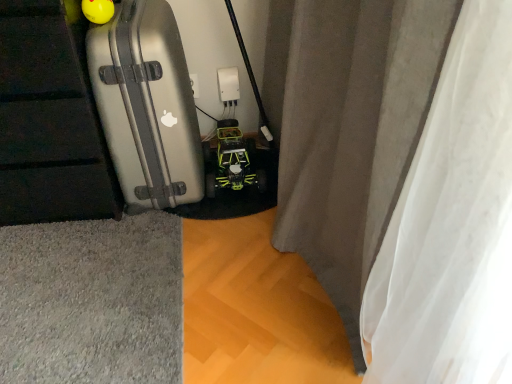
Measure the distance between yellow-green plastic toy car at center and camera.

The depth of yellow-green plastic toy car at center is 5.39 feet.

What is the approximate width of gray fabric curtain at center?

The width of gray fabric curtain at center is 9.13 inches.

Find the location of a particular element. The width and height of the screenshot is (512, 384). yellow-green plastic toy car at center is located at coordinates (232, 161).

Are silver metallic suitcase at left and yellow-green plastic toy car at center far apart?

silver metallic suitcase at left is actually quite close to yellow-green plastic toy car at center.

Does point (112, 41) come in front of point (229, 175)?

Yes, point (112, 41) is in front of point (229, 175).

Is yellow-green plastic toy car at center completely or partially inside silver metallic suitcase at left?

Definitely not — yellow-green plastic toy car at center is not inside silver metallic suitcase at left.

In terms of height, does silver metallic suitcase at left look taller or shorter compared to yellow-green plastic toy car at center?

Clearly, silver metallic suitcase at left is taller compared to yellow-green plastic toy car at center.

From their relative heights in the image, would you say yellow-green plastic toy car at center is taller or shorter than silver metallic suitcase at left?

Clearly, yellow-green plastic toy car at center is shorter compared to silver metallic suitcase at left.

Is yellow-green plastic toy car at center not near silver metallic suitcase at left?

No.

Considering the relative positions of yellow-green plastic toy car at center and silver metallic suitcase at left in the image provided, is yellow-green plastic toy car at center to the left of silver metallic suitcase at left from the viewer's perspective?

Incorrect, yellow-green plastic toy car at center is not on the left side of silver metallic suitcase at left.

From the image's perspective, is yellow-green plastic toy car at center above silver metallic suitcase at left?

No, from the image's perspective, yellow-green plastic toy car at center is not over silver metallic suitcase at left.

Between gray fabric curtain at center and silver metallic suitcase at left, which one has smaller width?

Thinner between the two is gray fabric curtain at center.

From the image's perspective, relative to silver metallic suitcase at left, is gray fabric curtain at center above or below?

Based on their image positions, gray fabric curtain at center is located beneath silver metallic suitcase at left.

Which of these two, gray fabric curtain at center or silver metallic suitcase at left, stands taller?

gray fabric curtain at center is taller.

Is the position of gray fabric curtain at center less distant than that of yellow-green plastic toy car at center?

Yes.

Consider the image. From the image's perspective, is gray fabric curtain at center beneath yellow-green plastic toy car at center?

No, from the image's perspective, gray fabric curtain at center is not beneath yellow-green plastic toy car at center.

Find the location of a particular element. curtain that is on the right side of yellow-green plastic toy car at center is located at coordinates (353, 132).

Can you confirm if silver metallic suitcase at left is thinner than gray fabric curtain at center?

In fact, silver metallic suitcase at left might be wider than gray fabric curtain at center.

At what (x,y) coordinates should I click in order to perform the action: click on suitcase behind the gray fabric curtain at center. Please return your answer as a coordinate pair (x, y). The height and width of the screenshot is (384, 512). Looking at the image, I should click on (147, 105).

Relative to gray fabric curtain at center, is silver metallic suitcase at left in front or behind?

Visually, silver metallic suitcase at left is located behind gray fabric curtain at center.

Which of these two, silver metallic suitcase at left or gray fabric curtain at center, stands taller?

With more height is gray fabric curtain at center.

In the scene shown: Is yellow-green plastic toy car at center far away from gray fabric curtain at center?

No, yellow-green plastic toy car at center is in close proximity to gray fabric curtain at center.

Is yellow-green plastic toy car at center in front of gray fabric curtain at center?

That is False.

Is yellow-green plastic toy car at center facing towards gray fabric curtain at center?

No.

In terms of width, does yellow-green plastic toy car at center look wider or thinner when compared to gray fabric curtain at center?

Clearly, yellow-green plastic toy car at center has more width compared to gray fabric curtain at center.

This screenshot has height=384, width=512. Identify the location of toy car on the right of silver metallic suitcase at left. (232, 161).

Identify the location of toy car below the silver metallic suitcase at left (from the image's perspective). (232, 161).

Based on their spatial positions, is silver metallic suitcase at left or gray fabric curtain at center closer to yellow-green plastic toy car at center?

Based on the image, silver metallic suitcase at left appears to be nearer to yellow-green plastic toy car at center.

Which object lies further to the anchor point silver metallic suitcase at left, gray fabric curtain at center or yellow-green plastic toy car at center?

gray fabric curtain at center is further to silver metallic suitcase at left.

Which object lies further to the anchor point gray fabric curtain at center, yellow-green plastic toy car at center or silver metallic suitcase at left?

Among the two, yellow-green plastic toy car at center is located further to gray fabric curtain at center.

Estimate the real-world distances between objects in this image. Which object is further from yellow-green plastic toy car at center, gray fabric curtain at center or silver metallic suitcase at left?

Based on the image, gray fabric curtain at center appears to be further to yellow-green plastic toy car at center.

Considering their positions, is yellow-green plastic toy car at center positioned closer to silver metallic suitcase at left than gray fabric curtain at center?

yellow-green plastic toy car at center lies closer to silver metallic suitcase at left than the other object.

Based on their spatial positions, is silver metallic suitcase at left or yellow-green plastic toy car at center closer to gray fabric curtain at center?

The object closer to gray fabric curtain at center is silver metallic suitcase at left.

I want to click on suitcase positioned between gray fabric curtain at center and yellow-green plastic toy car at center from near to far, so click(x=147, y=105).